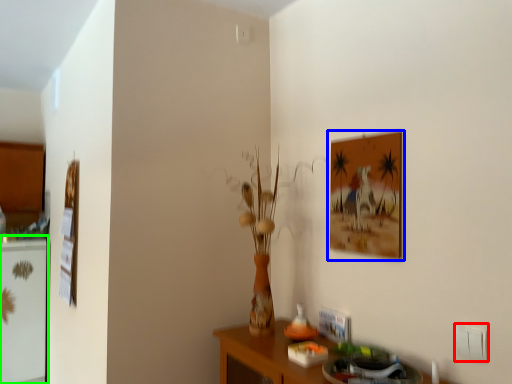
Question: Estimate the real-world distances between objects in this image. Which object is closer to electric outlet (highlighted by a red box), picture frame (highlighted by a blue box) or fridge (highlighted by a green box)?

Choices:
 (A) picture frame
 (B) fridge

Answer: (A)